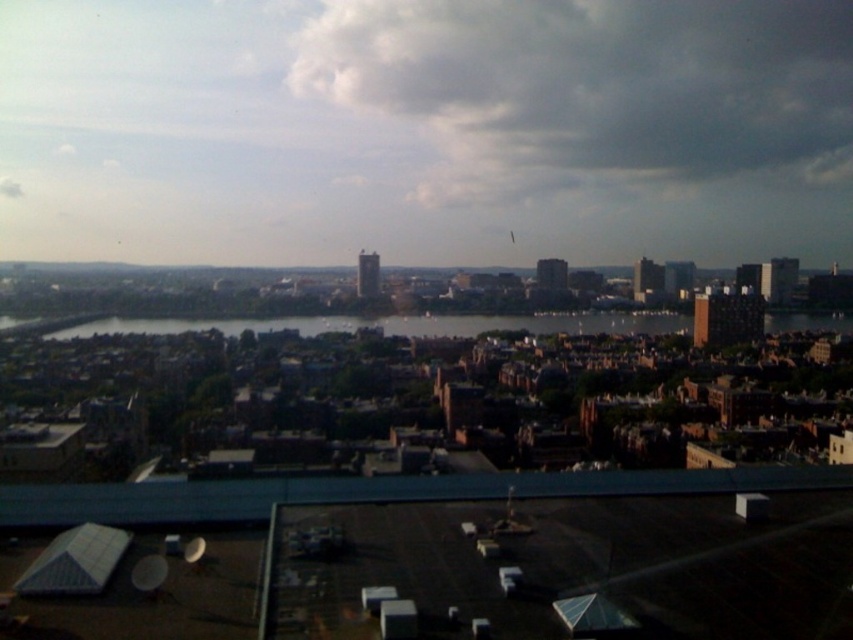
You are an architect designing a new building and want to ensure it blends with the urban landscape shown. Considering the white fluffy cloud at upper center and the dark blue water at center, which object should you reference for size comparison to maintain scale?

The white fluffy cloud at upper center is larger in size than the dark blue water at center, so referencing the cloud would help maintain a larger scale for the building design.